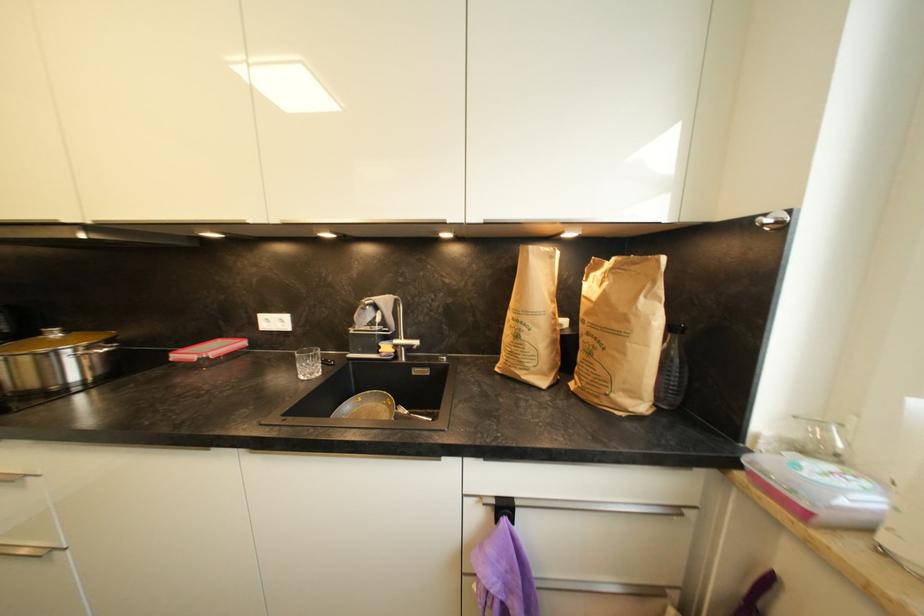
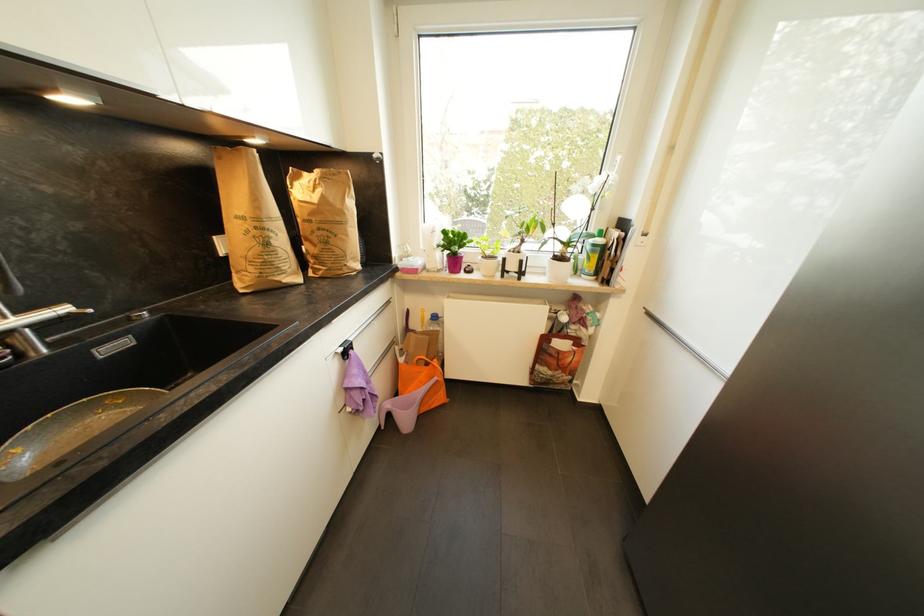
The point at (499, 504) is marked in the first image. Where is the corresponding point in the second image?

(346, 351)